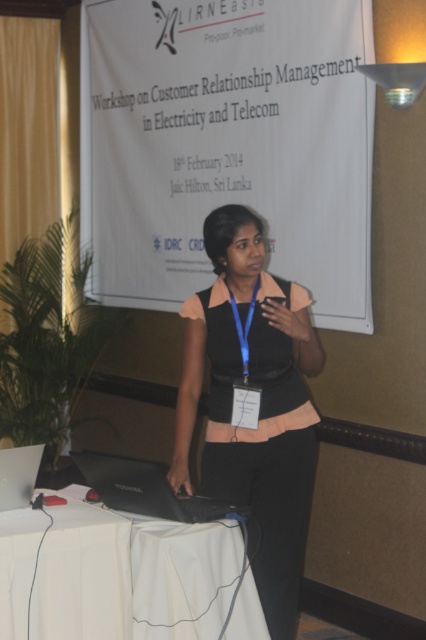
You are a participant in the workshop and need to reach the silver metallic laptop at lower left from your position near the black matte vest at center. Is the distance between them sufficient for you to comfortably walk without needing to move any furniture?

The distance between the black matte vest at center and the silver metallic laptop at lower left is 36.37 inches. Since this distance is relatively short, you can comfortably reach the laptop without needing to move any furniture.

You are an event organizer who needs to adjust the placement of the matte black laptop at center and the black matte vest at center so that they are exactly 1 meter apart. Based on the current distance between them, is the current distance sufficient or do you need to move them closer or farther apart?

The current distance between the matte black laptop at center and the black matte vest at center is 1.17 meters. Since 1.17 meters is greater than 1 meter, you need to move them closer together to achieve the desired 1 meter distance.